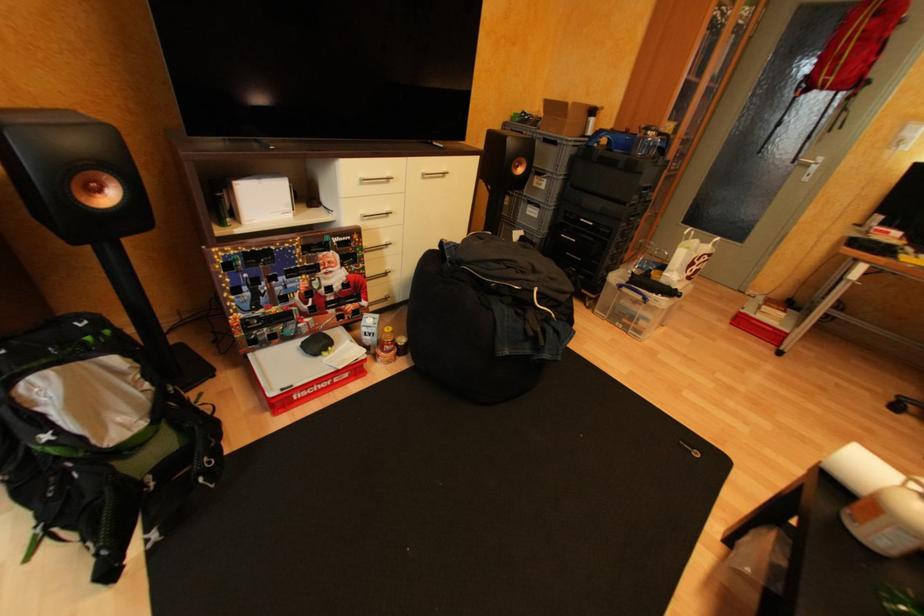
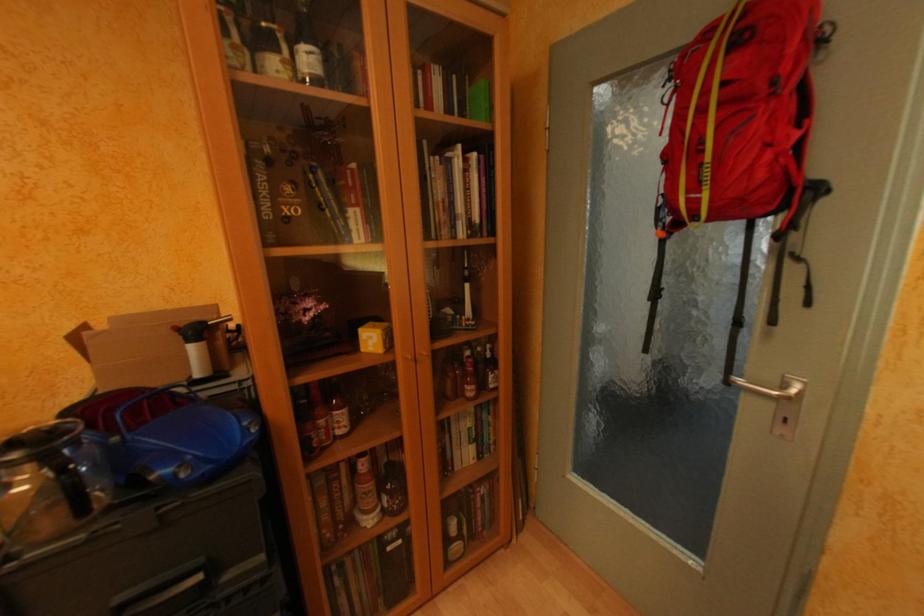
Which direction would the cameraman need to move to produce the second image?

The cameraman walked toward right, forward.